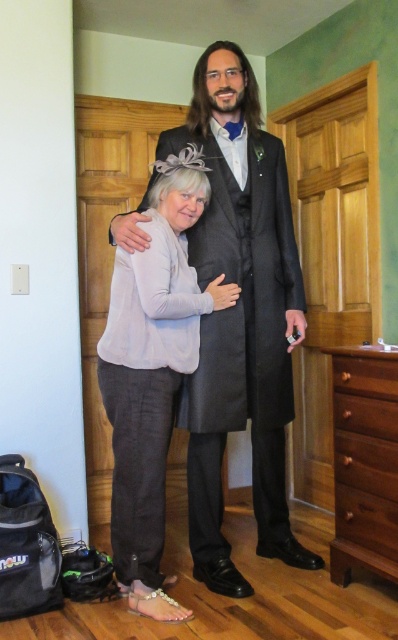
Question: Estimate the real-world distances between objects in this image. Which object is farther from the brown wood drawer at lower right?

Choices:
 (A) matte black suit at center
 (B) light gray linen blouse at center

Answer: (B)

Question: Which point is closer to the camera taking this photo?

Choices:
 (A) (388, 390)
 (B) (101, 387)

Answer: (A)

Question: Does matte black suit at center have a lesser width compared to brown wood dresser at lower right?

Choices:
 (A) yes
 (B) no

Answer: (B)

Question: Is light gray linen blouse at center below brown wood dresser at lower right?

Choices:
 (A) no
 (B) yes

Answer: (A)

Question: Which of the following is the farthest from the observer?

Choices:
 (A) (364, 372)
 (B) (349, 561)
 (C) (206, 65)
 (D) (152, 525)

Answer: (C)

Question: Does light gray linen blouse at center have a smaller size compared to brown wood drawer at lower right?

Choices:
 (A) no
 (B) yes

Answer: (A)